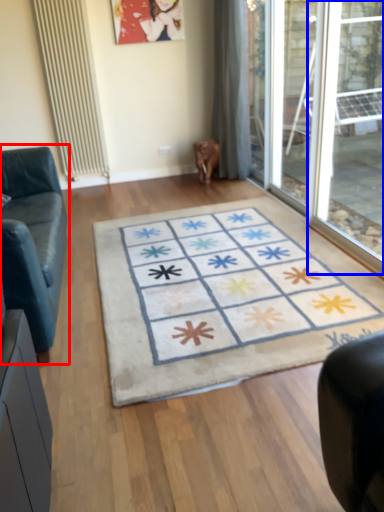
Question: Which of the following is the closest to the observer, studio couch (highlighted by a red box) or window (highlighted by a blue box)?

Choices:
 (A) studio couch
 (B) window

Answer: (A)